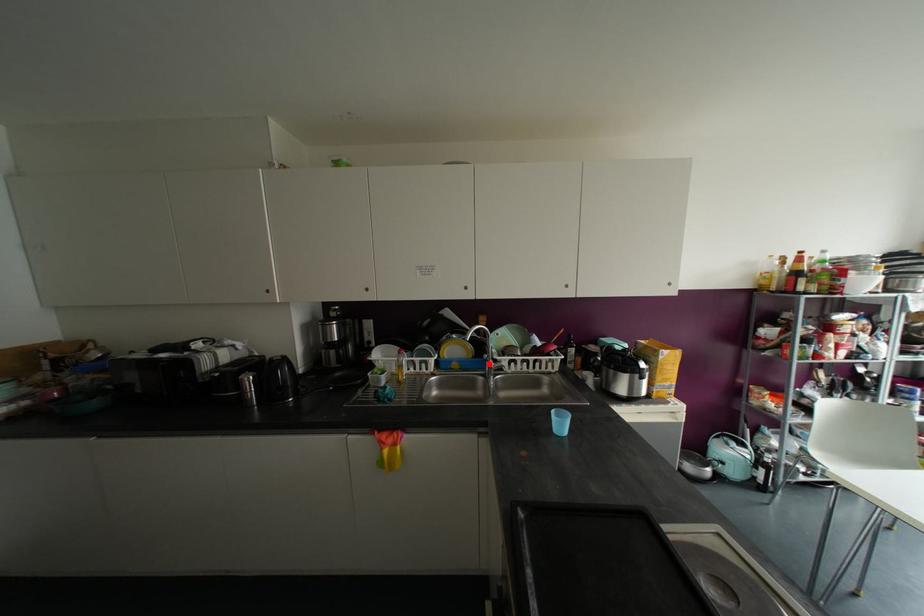
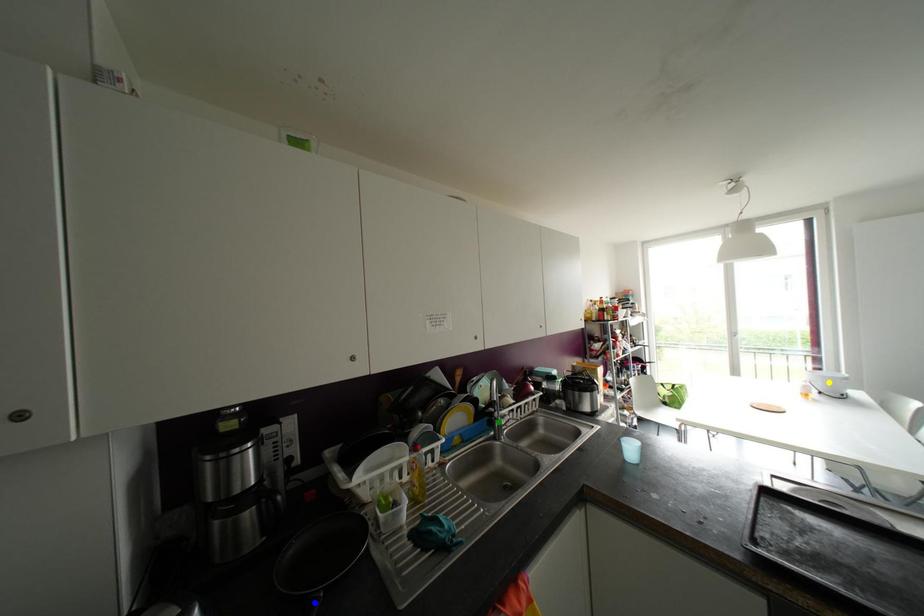
Question: I am providing you with two images of the same scene from different viewpoints. A red point is marked on the first image. You are given multiple points on the second image. Which point in image 2 is actually the same real-world point as the red point in image 1?

Choices:
 (A) blue point
 (B) green point
 (C) yellow point

Answer: (B)